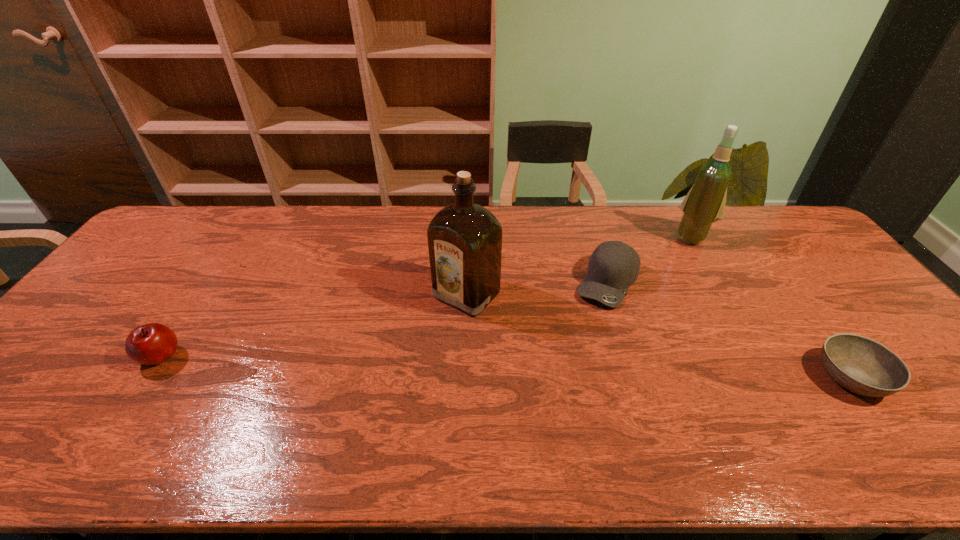
Locate an element on the screen. free space that is in between the apple and the shortest object is located at coordinates (506, 367).

Find the location of `free spot between the wine bottle and the leftmost object`. free spot between the wine bottle and the leftmost object is located at coordinates (426, 296).

Find the location of a particular element. The image size is (960, 540). free area in between the baseball cap and the liquor is located at coordinates (537, 288).

Image resolution: width=960 pixels, height=540 pixels. Find the location of `free space that is in between the liquor and the third object from left to right`. free space that is in between the liquor and the third object from left to right is located at coordinates (537, 288).

Where is `free spot between the liquor and the third object from left to right`? This screenshot has height=540, width=960. free spot between the liquor and the third object from left to right is located at coordinates (537, 288).

Point out which object is positioned as the fourth nearest to the leftmost object. Please provide its 2D coordinates. Your answer should be formatted as a tuple, i.e. [(x, y)], where the tuple contains the x and y coordinates of a point satisfying the conditions above.

[(863, 366)]

Where is `object that is the fourth closest one to the liquor`? The width and height of the screenshot is (960, 540). object that is the fourth closest one to the liquor is located at coordinates (863, 366).